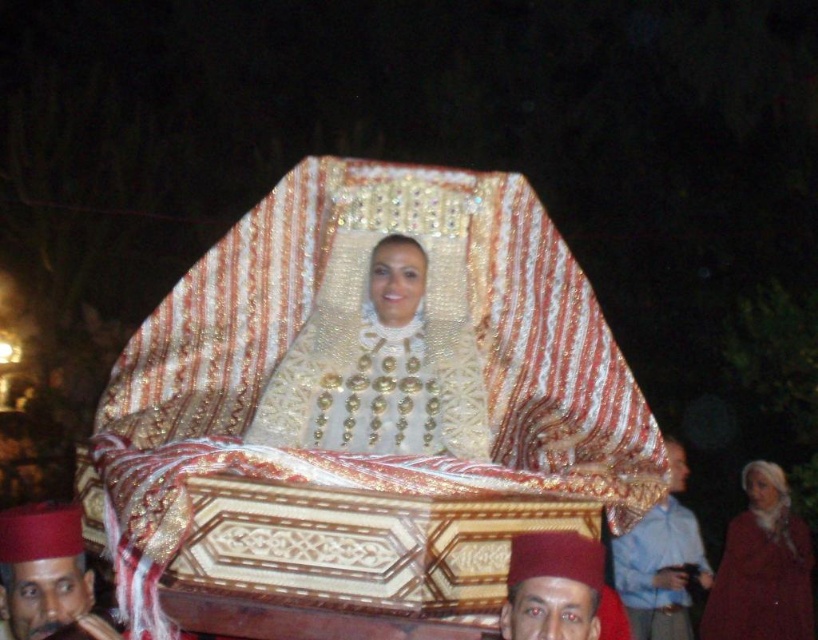
Question: Which of the following is the closest to the observer?

Choices:
 (A) velvet maroon robe at lower right
 (B) matte red fez at lower center
 (C) blue cotton shirt at lower right

Answer: (B)

Question: Can you confirm if matte red hat at lower left is wider than matte red fez at lower center?

Choices:
 (A) yes
 (B) no

Answer: (A)

Question: Is velvet maroon robe at lower right further to camera compared to matte red fez at lower center?

Choices:
 (A) no
 (B) yes

Answer: (B)

Question: Which object is farther from the camera taking this photo?

Choices:
 (A) blue cotton shirt at lower right
 (B) matte red fez at lower center

Answer: (A)

Question: Is matte red hat at lower left closer to the viewer compared to matte red fez at lower center?

Choices:
 (A) no
 (B) yes

Answer: (A)

Question: Considering the real-world distances, which object is closest to the blue cotton shirt at lower right?

Choices:
 (A) matte red hat at lower left
 (B) velvet maroon robe at lower right

Answer: (B)